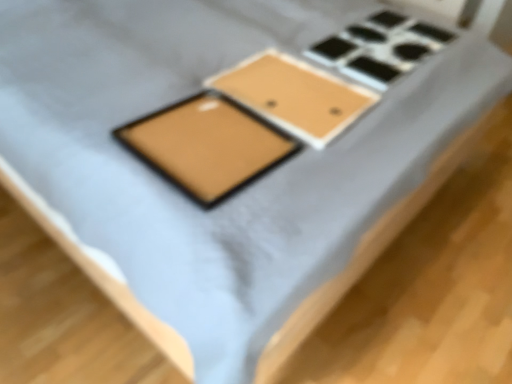
Where is `matte gold tablet at center`? The height and width of the screenshot is (384, 512). matte gold tablet at center is located at coordinates (207, 145).

This screenshot has width=512, height=384. What do you see at coordinates (207, 145) in the screenshot?
I see `matte gold tablet at center` at bounding box center [207, 145].

The height and width of the screenshot is (384, 512). Describe the element at coordinates (294, 96) in the screenshot. I see `matte brown tray at center` at that location.

You are a GUI agent. You are given a task and a screenshot of the screen. Output one action in this format:
    pyautogui.click(x=<x>, y=<y>)
    Task: Click on the matte brown tray at center
    
    Given the screenshot: What is the action you would take?
    click(x=294, y=96)

The image size is (512, 384). I want to click on matte gold tablet at center, so click(207, 145).

Considering the positions of objects matte gold tablet at center and matte brown tray at center in the image provided, who is more to the left, matte gold tablet at center or matte brown tray at center?

Positioned to the left is matte gold tablet at center.

Which object is closer to the camera, matte gold tablet at center or matte brown tray at center?

Positioned in front is matte gold tablet at center.

Considering the points (192, 106) and (332, 82), which point is in front, point (192, 106) or point (332, 82)?

The point (192, 106) is closer to the camera.

From the image's perspective, which is below, matte gold tablet at center or matte brown tray at center?

matte gold tablet at center is shown below in the image.

From a real-world perspective, which object stands above the other?

In real-world perspective, matte gold tablet at center is above.

Which of these two, matte gold tablet at center or matte brown tray at center, is thinner?

matte gold tablet at center is thinner.

Considering the sizes of objects matte gold tablet at center and matte brown tray at center in the image provided, who is shorter, matte gold tablet at center or matte brown tray at center?

With less height is matte brown tray at center.

Considering the sizes of objects matte gold tablet at center and matte brown tray at center in the image provided, who is bigger, matte gold tablet at center or matte brown tray at center?

Bigger between the two is matte gold tablet at center.

Which is correct: matte gold tablet at center is inside matte brown tray at center, or outside of it?

matte gold tablet at center lies outside matte brown tray at center.

Are matte gold tablet at center and matte brown tray at center making contact?

No.

Does matte gold tablet at center turn towards matte brown tray at center?

No, matte gold tablet at center is not oriented towards matte brown tray at center.

How different are the orientations of matte gold tablet at center and matte brown tray at center in degrees?

There is a 0.000371-degree angle between the facing directions of matte gold tablet at center and matte brown tray at center.

Where is `tablet computer to the left of matte brown tray at center`? tablet computer to the left of matte brown tray at center is located at coordinates (207, 145).

Considering the relative positions of matte brown tray at center and matte gold tablet at center in the image provided, is matte brown tray at center to the right of matte gold tablet at center from the viewer's perspective?

Yes, matte brown tray at center is to the right of matte gold tablet at center.

In the scene shown: Does matte brown tray at center come in front of matte gold tablet at center?

No, matte brown tray at center is further to the viewer.

Which is behind, point (281, 108) or point (188, 187)?

Point (281, 108)

From the image's perspective, is matte brown tray at center located above or below matte gold tablet at center?

matte brown tray at center is above matte gold tablet at center.

From a real-world perspective, is matte brown tray at center on matte gold tablet at center?

Actually, matte brown tray at center is physically below matte gold tablet at center in the real world.

Between matte brown tray at center and matte gold tablet at center, which one has smaller width?

With smaller width is matte gold tablet at center.

Consider the image. Between matte brown tray at center and matte gold tablet at center, which one has more height?

matte gold tablet at center is taller.

Considering the relative sizes of matte brown tray at center and matte gold tablet at center in the image provided, is matte brown tray at center smaller than matte gold tablet at center?

Yes, matte brown tray at center is smaller than matte gold tablet at center.

Would you say matte gold tablet at center is part of matte brown tray at center's contents?

No, matte brown tray at center does not contain matte gold tablet at center.

Are matte brown tray at center and matte gold tablet at center located far from each other?

Actually, matte brown tray at center and matte gold tablet at center are a little close together.

Is matte brown tray at center facing away from matte gold tablet at center?

No, matte brown tray at center is not facing the opposite direction of matte gold tablet at center.

What's the angular difference between matte brown tray at center and matte gold tablet at center's facing directions?

The facing directions of matte brown tray at center and matte gold tablet at center are 0.000371 degrees apart.

Find the location of a particular element. The image size is (512, 384). rectangle beneath the matte gold tablet at center (from a real-world perspective) is located at coordinates (294, 96).

The width and height of the screenshot is (512, 384). Identify the location of rectangle that is above the matte gold tablet at center (from the image's perspective). (294, 96).

This screenshot has width=512, height=384. I want to click on rectangle below the matte gold tablet at center (from a real-world perspective), so click(294, 96).